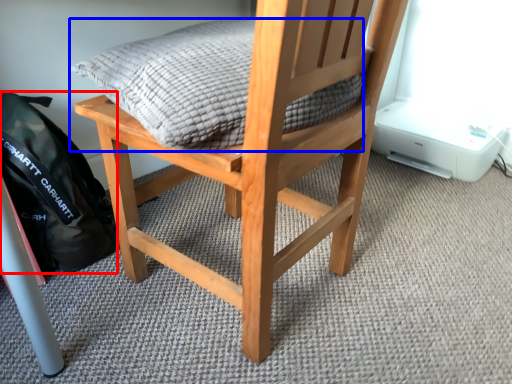
Question: Which of the following is the farthest to the observer, backpack (highlighted by a red box) or pillow (highlighted by a blue box)?

Choices:
 (A) backpack
 (B) pillow

Answer: (A)